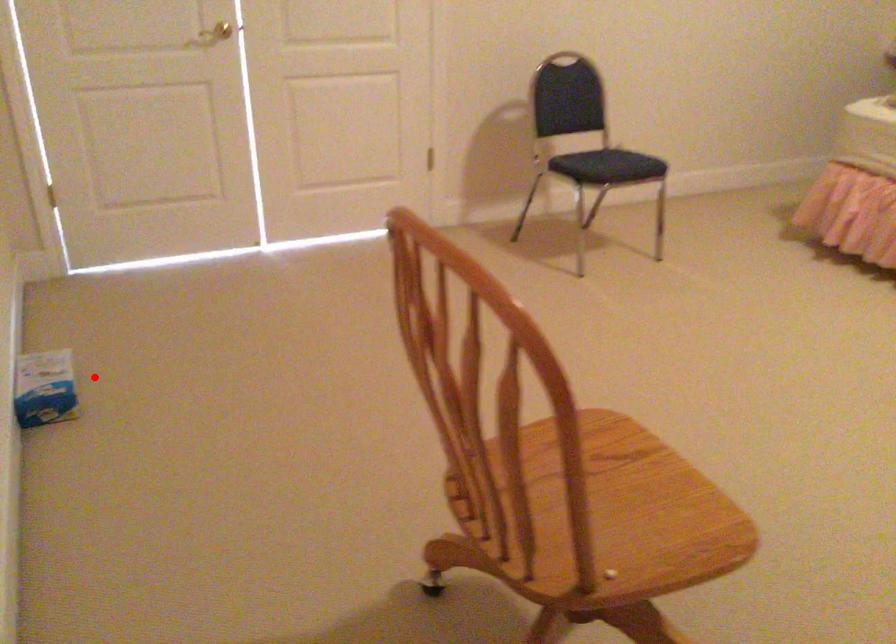
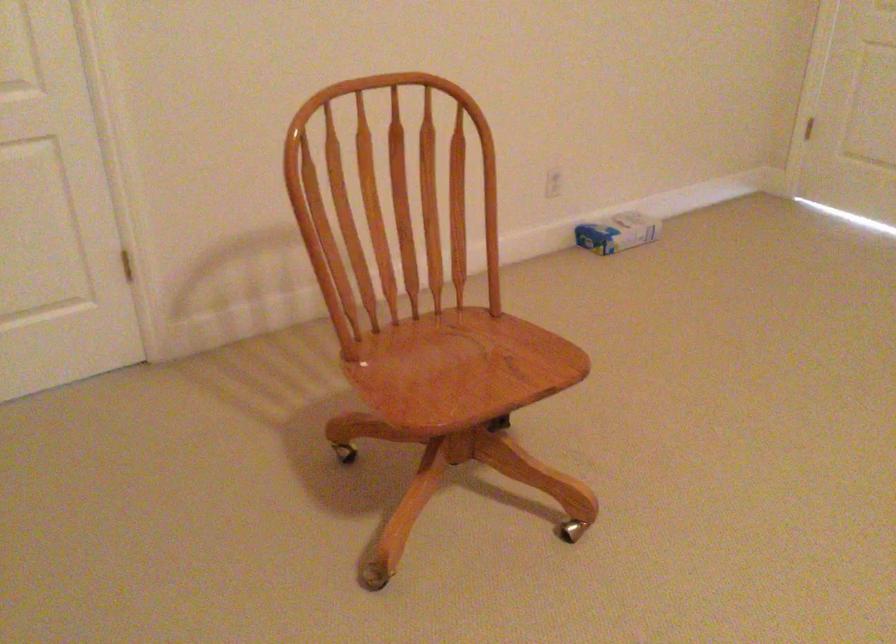
Question: A red point is marked in image1. In image2, is the corresponding 3D point closer to the camera or farther? Reply with the corresponding letter.

Choices:
 (A) The corresponding 3D point is closer.
 (B) The corresponding 3D point is farther.

Answer: (B)